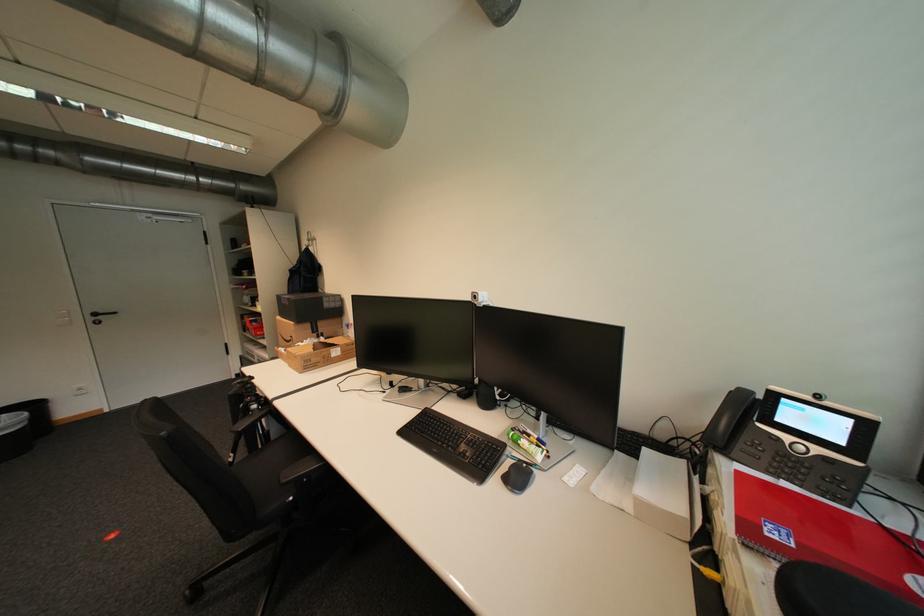
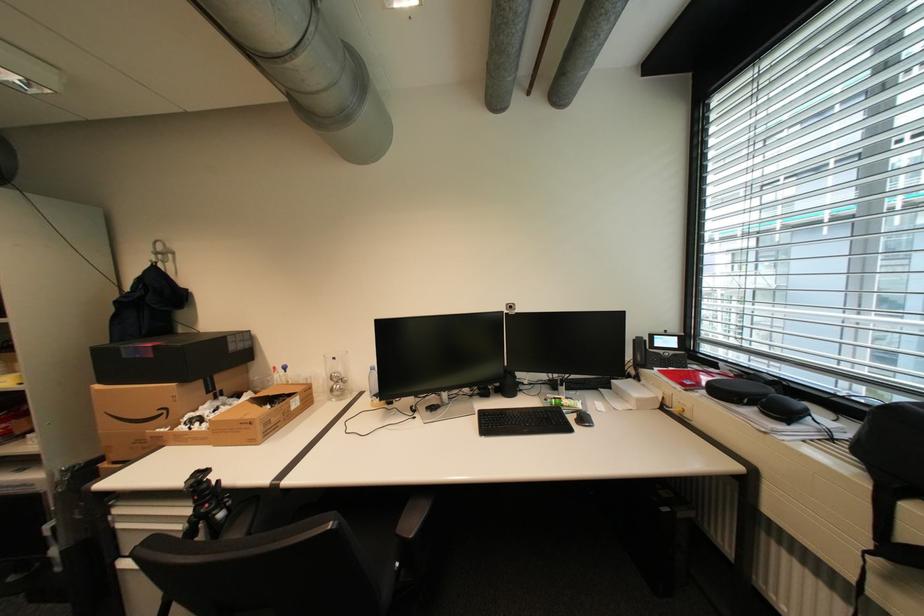
The point at (x=296, y=305) is marked in the first image. Where is the corresponding point in the second image?

(161, 357)